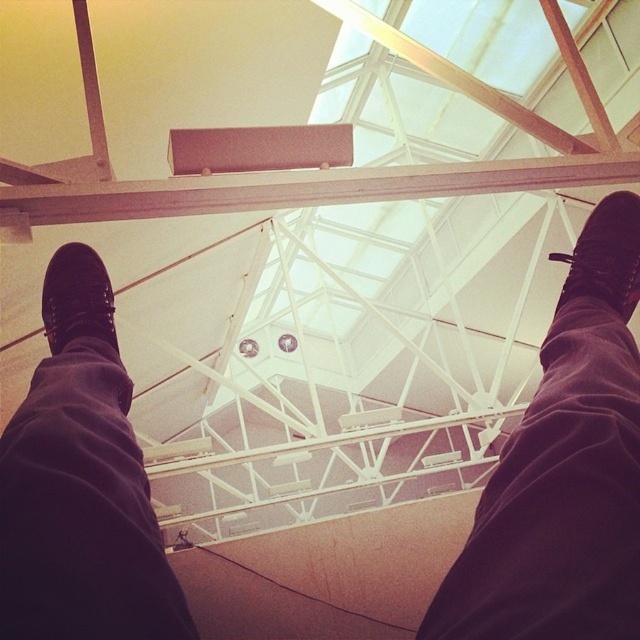
Question: Among these objects, which one is farthest from the camera?

Choices:
 (A) black leather shoe at right
 (B) black leather shoe at left

Answer: (A)

Question: Which object is positioned closest to the black leather shoe at left?

Choices:
 (A) black suede shoes at upper center
 (B) black leather shoe at right

Answer: (A)

Question: Is black leather shoe at right smaller than black leather shoe at left?

Choices:
 (A) yes
 (B) no

Answer: (B)

Question: From the image, what is the correct spatial relationship of black leather shoe at right in relation to black leather shoe at left?

Choices:
 (A) above
 (B) below

Answer: (A)

Question: Can you confirm if black suede shoes at upper center is bigger than black leather shoe at right?

Choices:
 (A) yes
 (B) no

Answer: (A)

Question: Among these objects, which one is nearest to the camera?

Choices:
 (A) black leather shoe at left
 (B) black suede shoes at upper center
 (C) black leather shoe at right

Answer: (B)